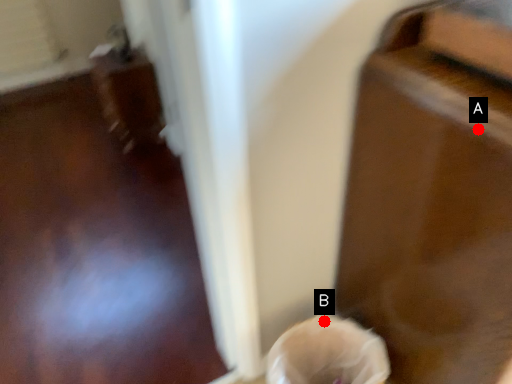
Question: Two points are circled on the image, labeled by A and B beside each circle. Which point is further to the camera?

Choices:
 (A) A is further
 (B) B is further

Answer: (B)